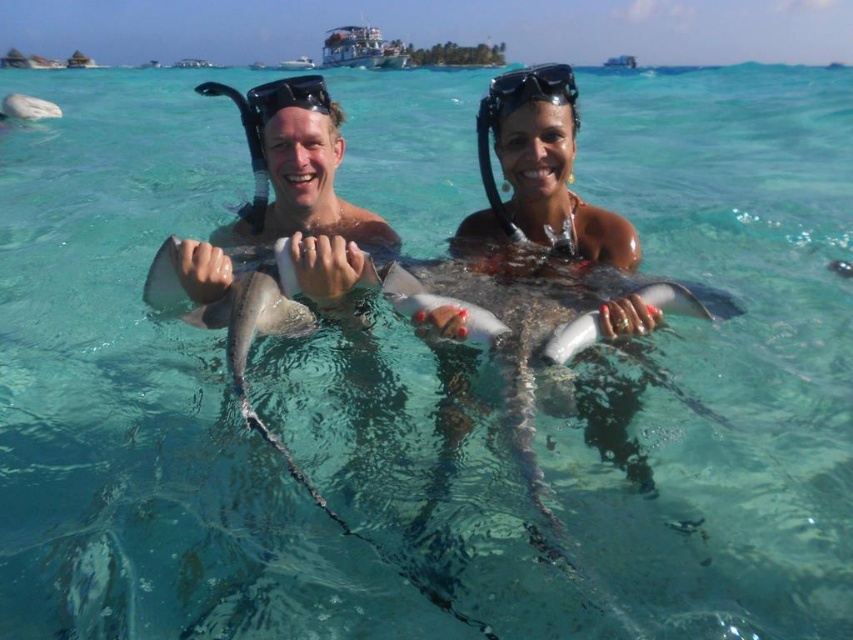
You are a snorkeling instructor preparing to distribute equipment to your students. You have two items in front of you on the table, the black rubber goggles at upper center and the black matte snorkel mask at upper center. The students need to have at least 6 feet of space between each piece of equipment to avoid tangling. Based on the current arrangement, will the students be able to safely retrieve both items without the equipment getting tangled?

The black rubber goggles at upper center and black matte snorkel mask at upper center are 5.87 feet apart from each other. Since the required distance is 6 feet, the current spacing is insufficient, so the students might experience tangling when retrieving both items.

You are a snorkeler who wants to ensure your equipment is properly positioned. You have two items on your headgear area. Which one is positioned more to the right between the black rubber goggles at upper center and the black matte snorkel mask at upper center?

The black rubber goggles at upper center is positioned more to the right compared to the black matte snorkel mask at upper center.